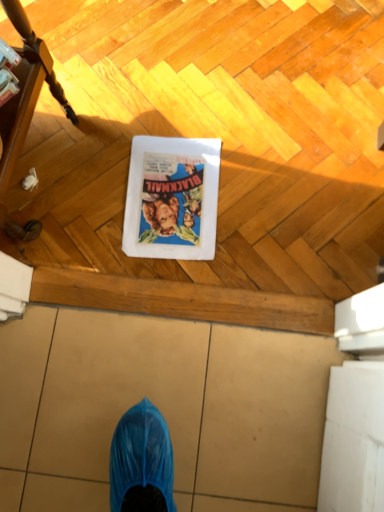
Question: Is brushed wood table at left situated inside matte paper comic book at center or outside?

Choices:
 (A) outside
 (B) inside

Answer: (A)

Question: Relative to matte paper comic book at center, is brushed wood table at left in front or behind?

Choices:
 (A) behind
 (B) front

Answer: (B)

Question: Considering the positions of point (13, 111) and point (145, 215), is point (13, 111) closer or farther from the camera than point (145, 215)?

Choices:
 (A) farther
 (B) closer

Answer: (B)

Question: Is point (162, 145) positioned closer to the camera than point (1, 177)?

Choices:
 (A) farther
 (B) closer

Answer: (A)

Question: Is matte paper comic book at center inside or outside of brushed wood table at left?

Choices:
 (A) inside
 (B) outside

Answer: (B)

Question: Is matte paper comic book at center to the left or to the right of brushed wood table at left in the image?

Choices:
 (A) left
 (B) right

Answer: (B)

Question: From a real-world perspective, is matte paper comic book at center physically located above or below brushed wood table at left?

Choices:
 (A) below
 (B) above

Answer: (A)